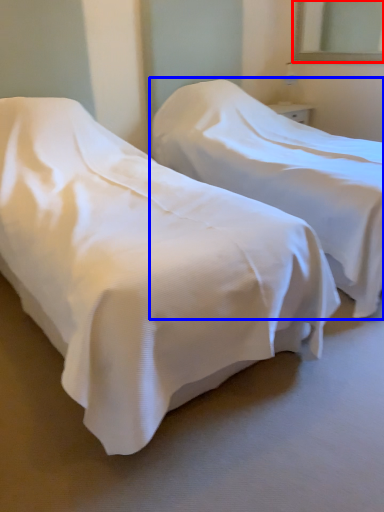
Question: Which of the following is the farthest to the observer, mirror (highlighted by a red box) or bed (highlighted by a blue box)?

Choices:
 (A) mirror
 (B) bed

Answer: (A)